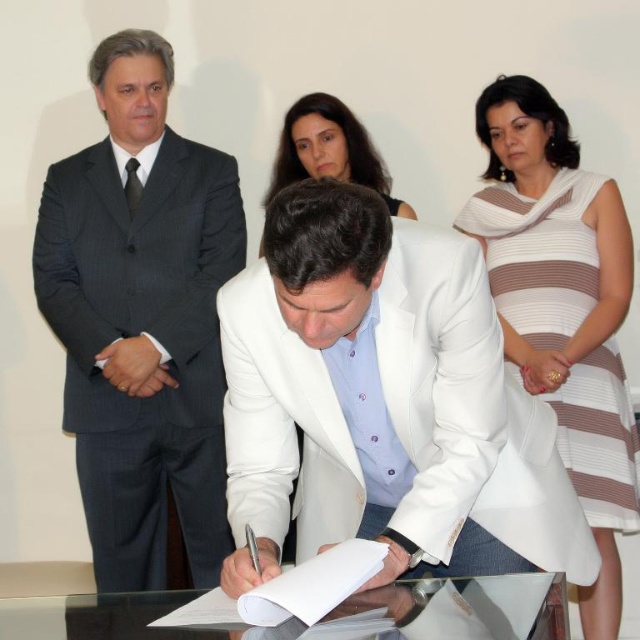
Question: Which point is farther from the camera taking this photo?

Choices:
 (A) (x=333, y=500)
 (B) (x=470, y=602)
 (C) (x=93, y=397)

Answer: (C)

Question: Which of the following is the farthest from the observer?

Choices:
 (A) (77, 268)
 (B) (308, 419)
 (C) (298, 116)
 (D) (556, 589)

Answer: (C)

Question: Can you confirm if striped fabric dress at upper right is smaller than transparent glass table at center?

Choices:
 (A) yes
 (B) no

Answer: (B)

Question: Observing the image, what is the correct spatial positioning of white matte jacket at center in reference to striped fabric dress at upper right?

Choices:
 (A) left
 (B) right

Answer: (A)

Question: Which of the following is the closest to the observer?

Choices:
 (A) (296, 129)
 (B) (564, 355)
 (C) (138, 321)

Answer: (B)

Question: Does white matte jacket at center have a lesser width compared to striped fabric dress at upper right?

Choices:
 (A) yes
 (B) no

Answer: (B)